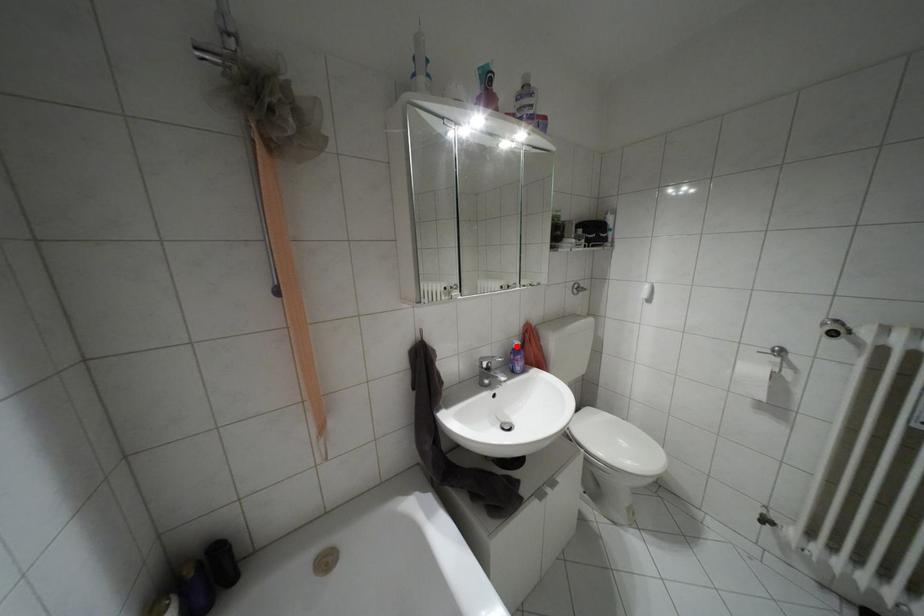
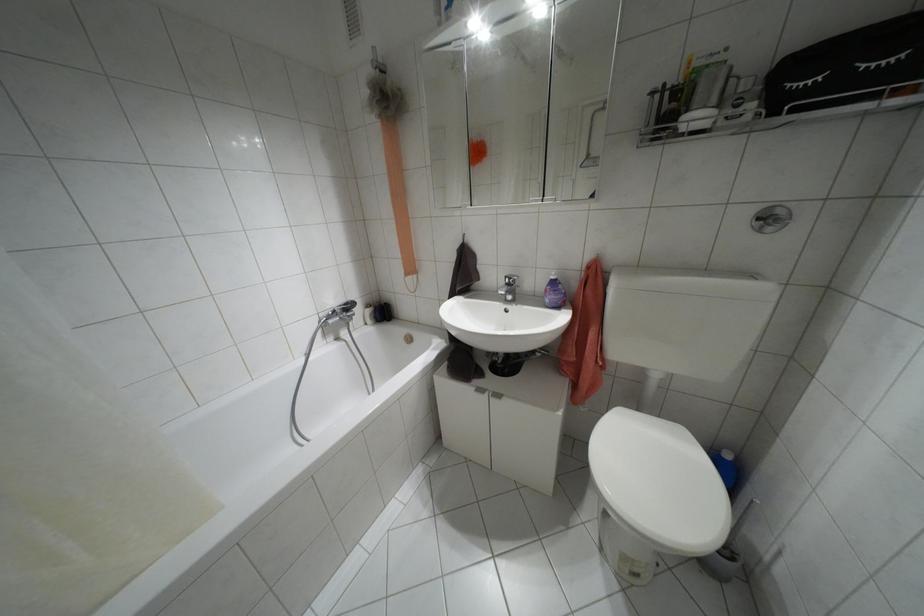
Question: I am providing you with two images of the same scene from different viewpoints. A red point is marked on the first image. At the location where the point appears in image 1, is it still visible in image 2?

Choices:
 (A) Yes
 (B) No

Answer: (A)